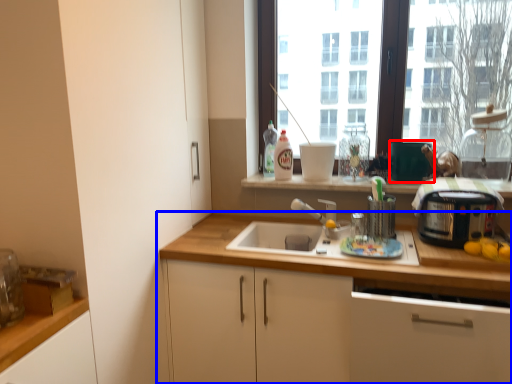
Question: Which of the following is the closest to the observer, appliance (highlighted by a red box) or cabinetry (highlighted by a blue box)?

Choices:
 (A) appliance
 (B) cabinetry

Answer: (B)